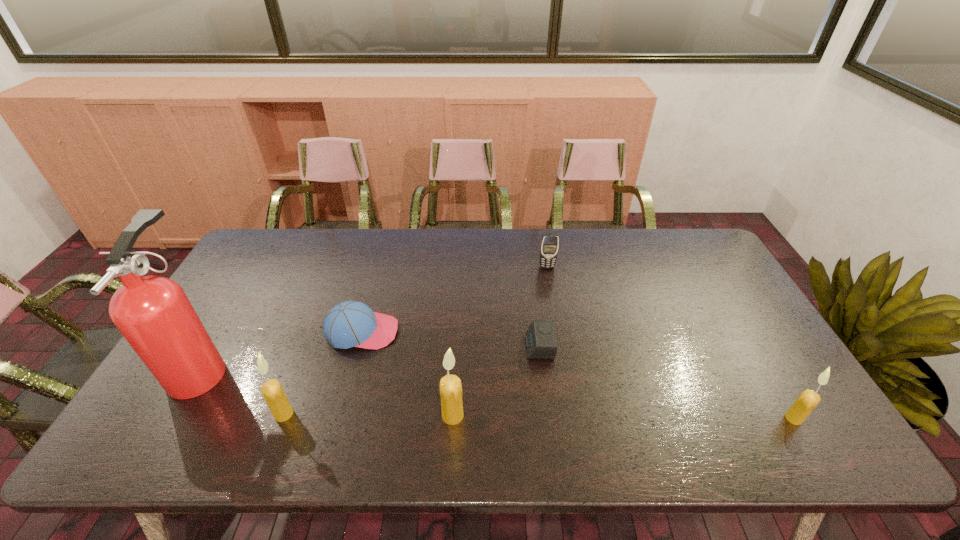
Where is `vacant area that satisfies the following two spatial constraints: 1. on the front face of the shortest candle; 2. on the left side of the cellular telephone`? The width and height of the screenshot is (960, 540). vacant area that satisfies the following two spatial constraints: 1. on the front face of the shortest candle; 2. on the left side of the cellular telephone is located at coordinates (574, 418).

Locate an element on the screen. Image resolution: width=960 pixels, height=540 pixels. vacant region that satisfies the following two spatial constraints: 1. on the front face of the rightmost candle; 2. on the left side of the third shortest object is located at coordinates (574, 418).